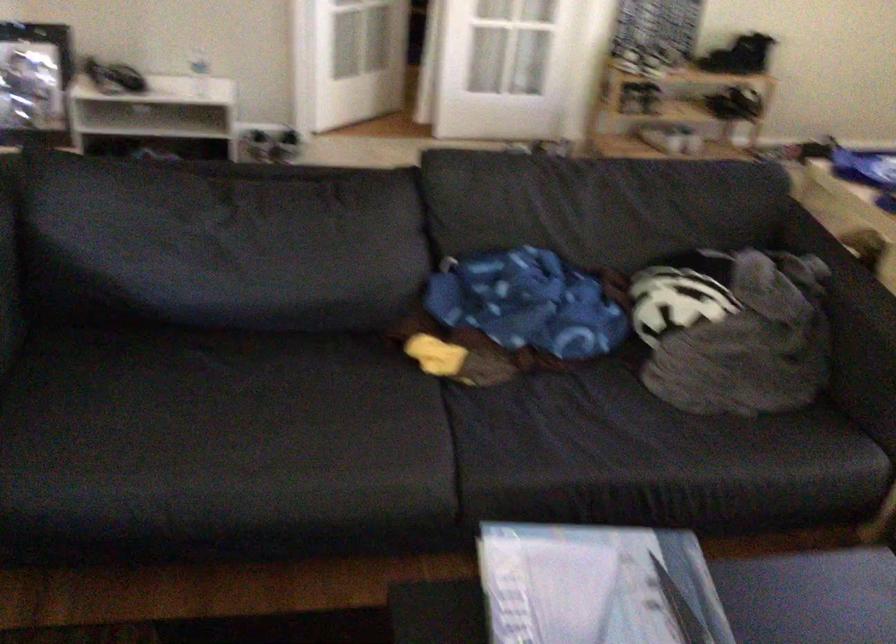
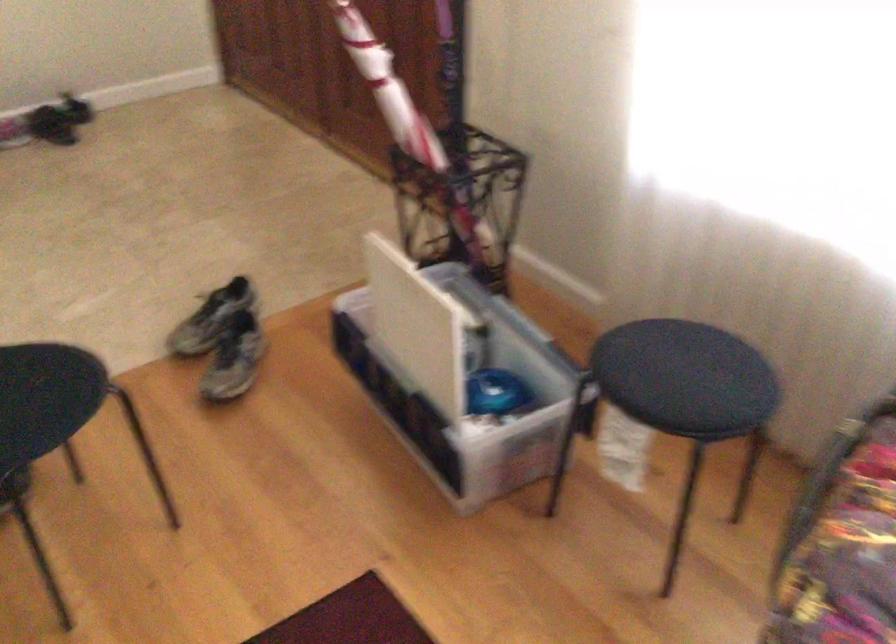
Question: Which direction would the cameraman need to move to produce the second image? Reply with the corresponding letter.

Choices:
 (A) Left
 (B) Right
 (C) Forward
 (D) Backward

Answer: (B)